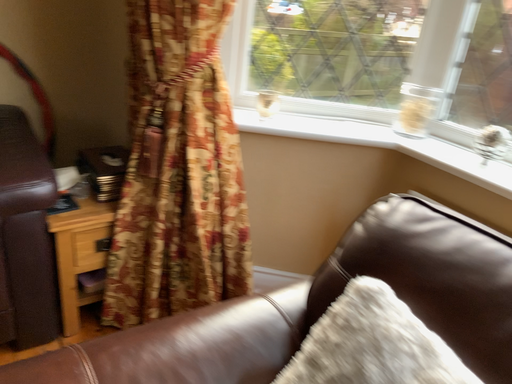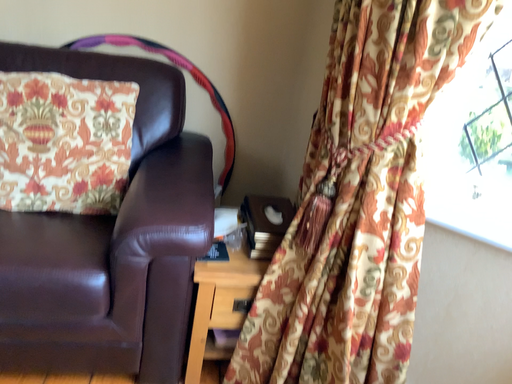
Question: How did the camera likely rotate when shooting the video?

Choices:
 (A) rotated upward
 (B) rotated downward

Answer: (A)